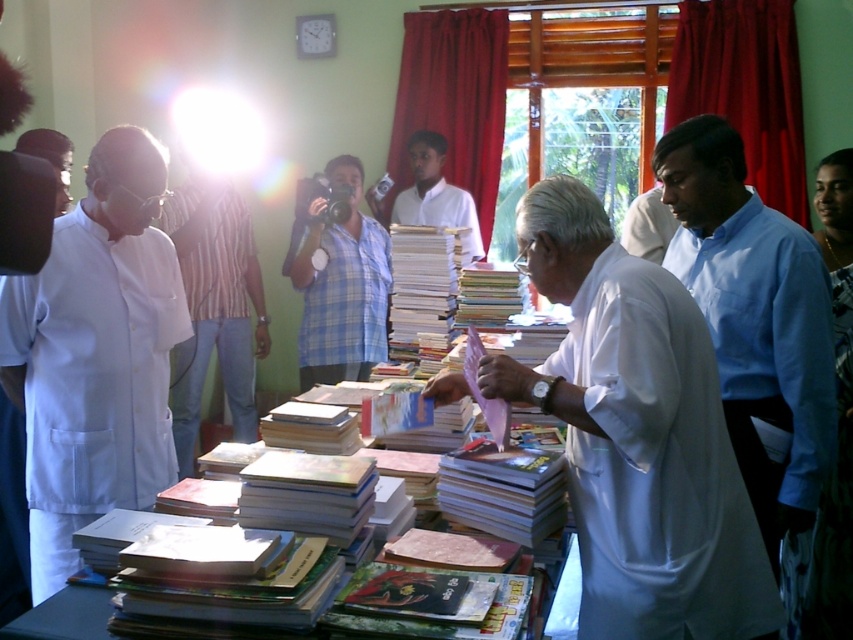
Question: Does white shirt at left come in front of wooden table at center?

Choices:
 (A) no
 (B) yes

Answer: (A)

Question: Can you confirm if blue shirt at right is bigger than wooden table at center?

Choices:
 (A) yes
 (B) no

Answer: (A)

Question: Which point is closer to the camera?

Choices:
 (A) white clothed man at center
 (B) blue shirt at right

Answer: (A)

Question: Which object appears farthest from the camera in this image?

Choices:
 (A) blue plaid shirt at center
 (B) white shirt at left
 (C) wooden table at center

Answer: (B)

Question: Does white matte shirt at center appear over wooden table at center?

Choices:
 (A) no
 (B) yes

Answer: (B)

Question: Which point is farther to the camera?

Choices:
 (A) (622, 460)
 (B) (245, 292)
 (C) (688, 289)
 (D) (42, 147)

Answer: (B)